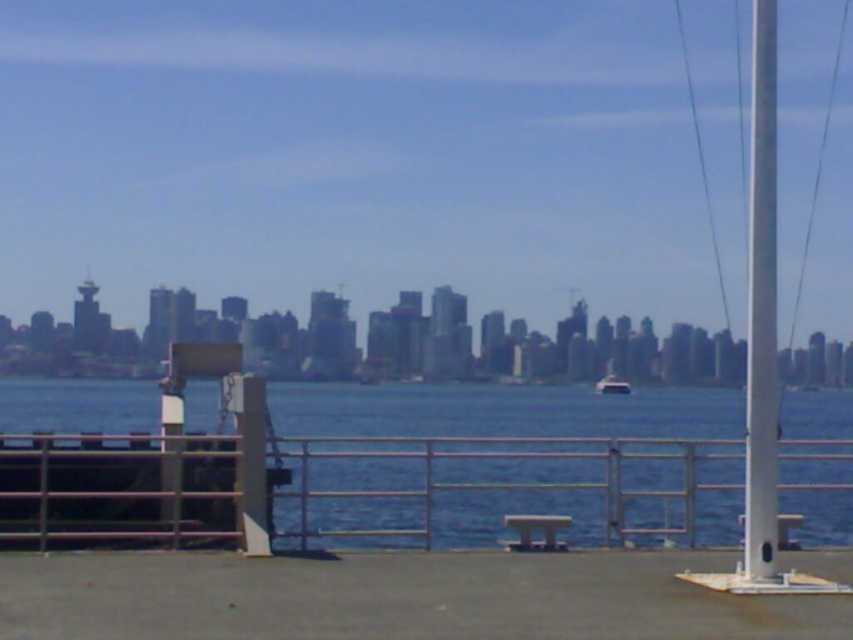
Question: Does smooth concrete dock at lower center appear under white plastic boat at center?

Choices:
 (A) no
 (B) yes

Answer: (A)

Question: Which of these objects is positioned farthest from the smooth concrete dock at lower center?

Choices:
 (A) white plastic boat at center
 (B) smooth silver pole at right

Answer: (A)

Question: Observing the image, what is the correct spatial positioning of blue water at center in reference to white plastic boat at center?

Choices:
 (A) above
 (B) below

Answer: (A)

Question: Does blue water at center appear under white plastic boat at center?

Choices:
 (A) no
 (B) yes

Answer: (A)

Question: Which point appears closest to the camera in this image?

Choices:
 (A) (613, 372)
 (B) (775, 113)
 (C) (656, 465)
 (D) (843, 620)

Answer: (D)

Question: Which of the following is the farthest from the observer?

Choices:
 (A) (618, 378)
 (B) (595, 433)
 (C) (173, 616)

Answer: (A)